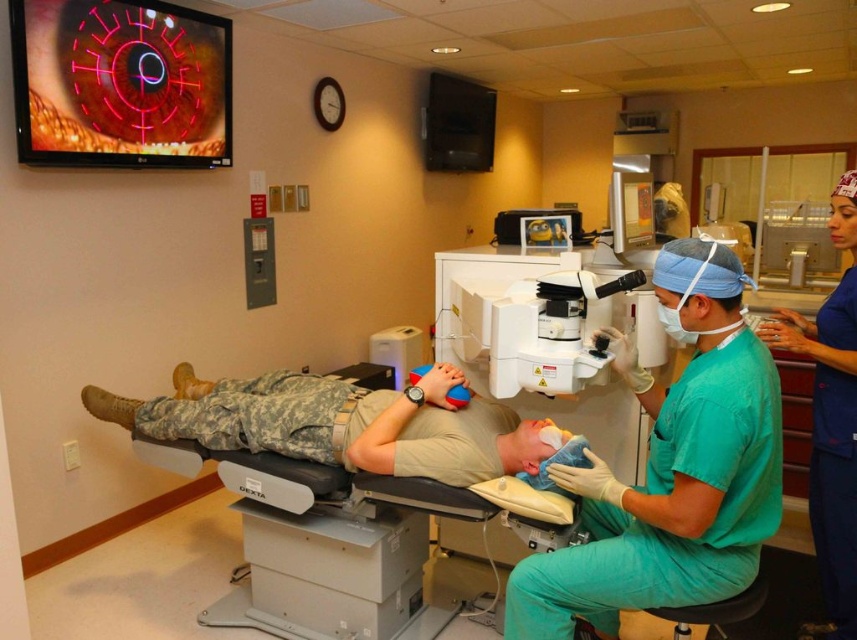
Based on the photo, can you confirm if green scrubs at center is positioned above blue rubber glove at lower center?

Actually, green scrubs at center is below blue rubber glove at lower center.

Which is in front, point (668, 579) or point (412, 380)?

Point (668, 579) is in front.

At what (x,y) coordinates should I click in order to perform the action: click on green scrubs at center. Please return your answer as a coordinate pair (x, y). This screenshot has height=640, width=857. Looking at the image, I should click on (670, 468).

Is point (235, 412) less distant than point (850, 328)?

No.

Where is `camouflage fabric uniform at center`? camouflage fabric uniform at center is located at coordinates (340, 422).

Does point (259, 432) come behind point (824, 336)?

Yes, it is behind point (824, 336).

Locate an element on the screen. camouflage fabric uniform at center is located at coordinates (340, 422).

Does green scrubs at center appear under camouflage fabric uniform at center?

Yes.

Measure the distance between green scrubs at center and camera.

A distance of 1.57 meters exists between green scrubs at center and camera.

Identify the location of green scrubs at center. This screenshot has height=640, width=857. (670, 468).